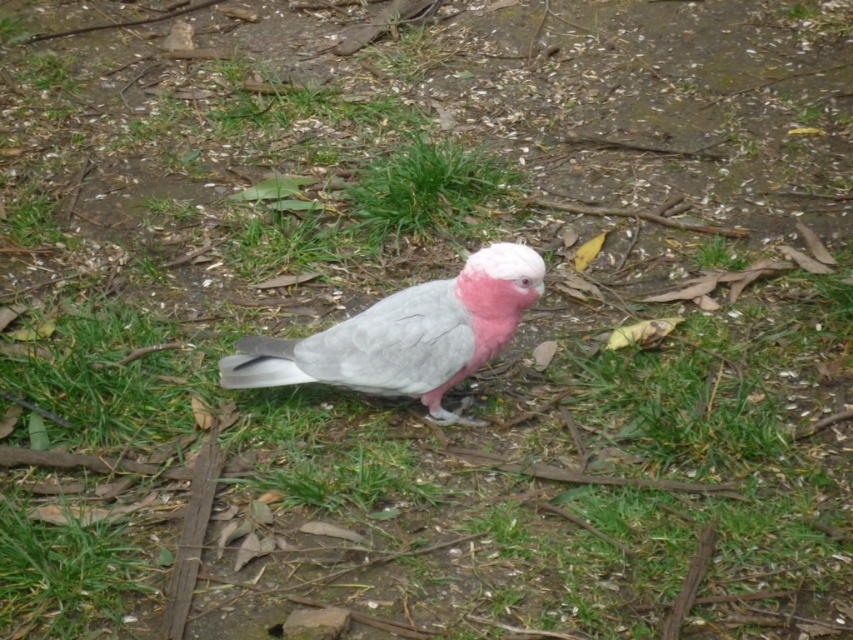
You are standing in a park and see a Galah bird with coordinates for its head and a nearby leaf. The head is at point (502,262) and the leaf is at point (456,154). Which coordinate is closer to you?

Point (502,262) is closer to the camera than point (456,154).

You are a photographer aiming to capture the gray matte parrot at center against the green leafy grass at center. Based on their positions, will the parrot be clearly visible against the background?

The gray matte parrot at center is in front of the green leafy grass at center, so yes, the parrot will be clearly visible against the background.

You are a small toy that is 10 cm tall. You want to hide behind the green leafy grass at center so that the gray matte parrot at center cannot see you. Will you be completely hidden?

The gray matte parrot at center is taller than green leafy grass at center. Since the parrot is taller than the grass, the toy will not be completely hidden as the grass may not reach the height of the toy or block the parrot view.